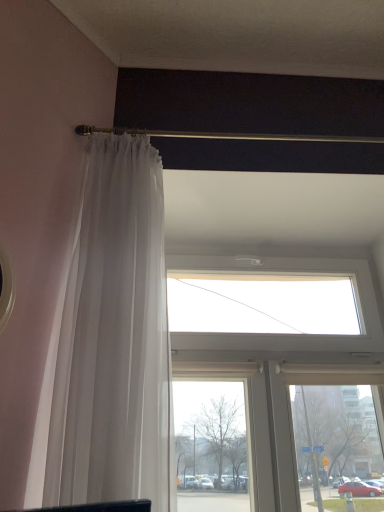
Question: Is gold metallic rod at upper center located outside sheer white curtain at left?

Choices:
 (A) yes
 (B) no

Answer: (A)

Question: Can you confirm if gold metallic rod at upper center is thinner than sheer white curtain at left?

Choices:
 (A) yes
 (B) no

Answer: (A)

Question: Is gold metallic rod at upper center closer to the viewer compared to sheer white curtain at left?

Choices:
 (A) no
 (B) yes

Answer: (A)

Question: Considering the relative sizes of gold metallic rod at upper center and sheer white curtain at left in the image provided, is gold metallic rod at upper center taller than sheer white curtain at left?

Choices:
 (A) yes
 (B) no

Answer: (B)

Question: From the image's perspective, is gold metallic rod at upper center on sheer white curtain at left?

Choices:
 (A) no
 (B) yes

Answer: (B)

Question: From a real-world perspective, is sheer white curtain at left positioned above or below gold metallic rod at upper center?

Choices:
 (A) above
 (B) below

Answer: (B)

Question: Considering the positions of sheer white curtain at left and gold metallic rod at upper center in the image, is sheer white curtain at left wider or thinner than gold metallic rod at upper center?

Choices:
 (A) wide
 (B) thin

Answer: (A)

Question: In terms of size, does sheer white curtain at left appear bigger or smaller than gold metallic rod at upper center?

Choices:
 (A) big
 (B) small

Answer: (A)

Question: Would you say sheer white curtain at left is inside or outside gold metallic rod at upper center?

Choices:
 (A) inside
 (B) outside

Answer: (B)

Question: Considering their positions, is sheer white curtain at left located in front of or behind transparent glass window at upper center?

Choices:
 (A) behind
 (B) front

Answer: (B)

Question: Is sheer white curtain at left situated inside transparent glass window at upper center or outside?

Choices:
 (A) inside
 (B) outside

Answer: (B)

Question: Is point (122, 177) closer or farther from the camera than point (175, 437)?

Choices:
 (A) farther
 (B) closer

Answer: (B)

Question: Is sheer white curtain at left bigger or smaller than transparent glass window at upper center?

Choices:
 (A) big
 (B) small

Answer: (B)

Question: Is gold metallic rod at upper center bigger or smaller than transparent glass window at upper center?

Choices:
 (A) big
 (B) small

Answer: (B)

Question: From their relative heights in the image, would you say gold metallic rod at upper center is taller or shorter than transparent glass window at upper center?

Choices:
 (A) short
 (B) tall

Answer: (A)